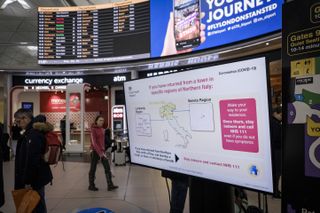
This screenshot has height=213, width=320. What are the coordinates of `pink box` in the screenshot? It's located at (255, 113).